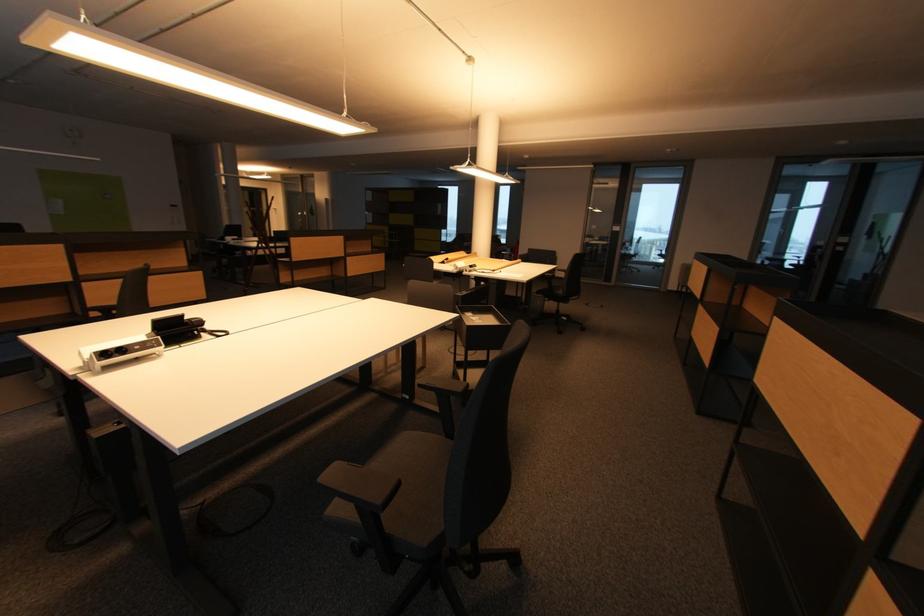
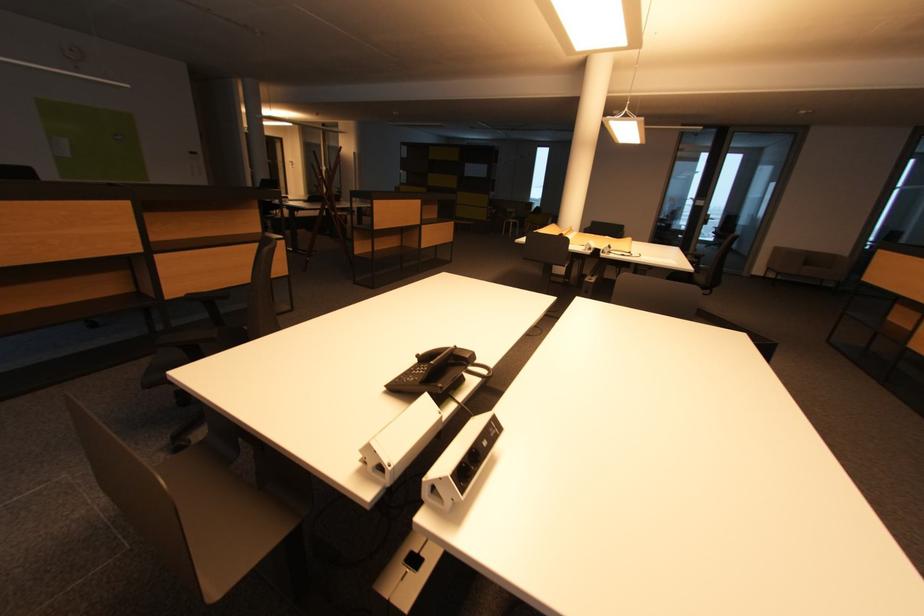
The images are taken continuously from a first-person perspective. In which direction are you moving?

The cameraman walked toward left, forward.